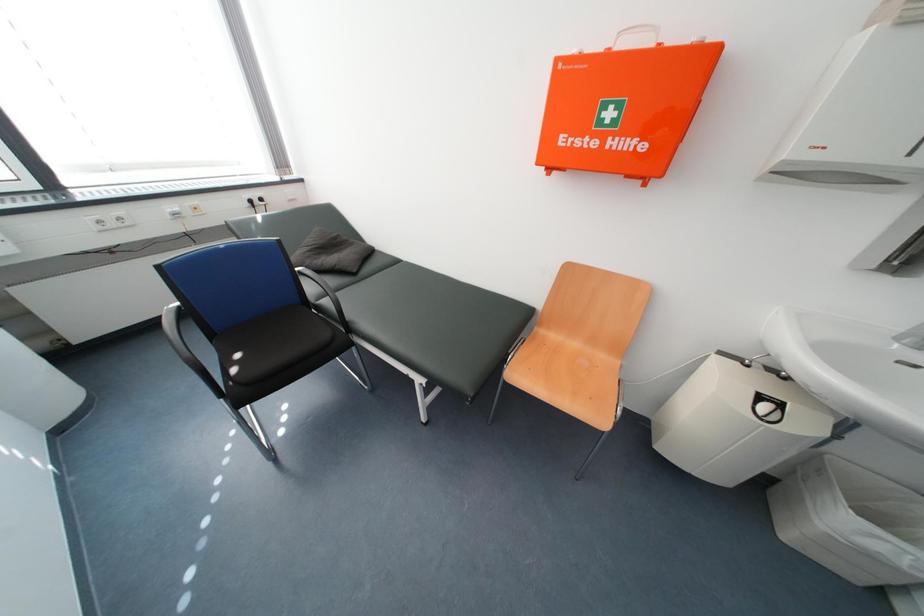
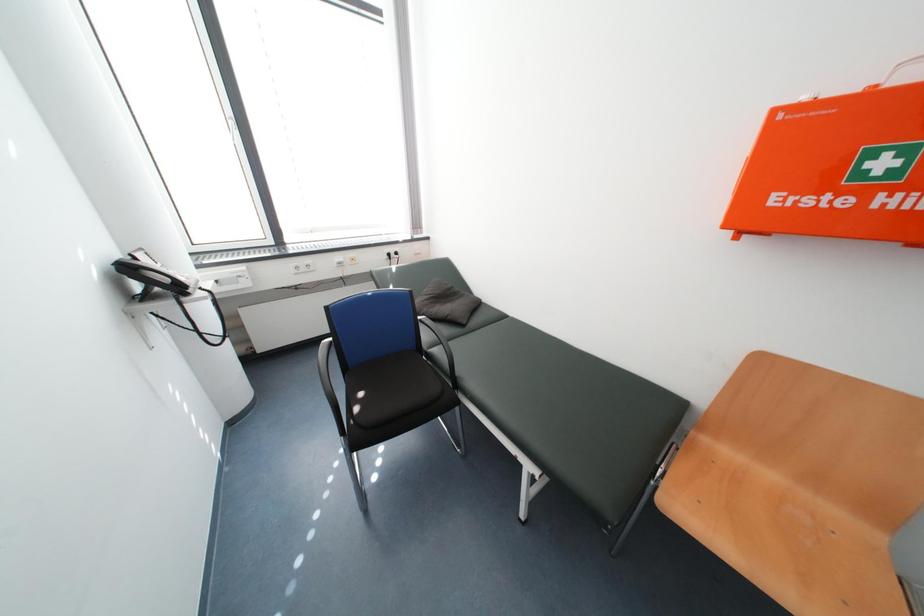
Question: Which direction would the cameraman need to move to produce the second image? Reply with the corresponding letter.

Choices:
 (A) Left
 (B) Right
 (C) Forward
 (D) Backward

Answer: (A)